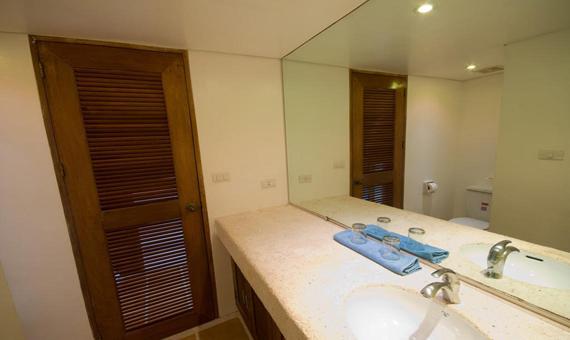
You are a GUI agent. You are given a task and a screenshot of the screen. Output one action in this format:
    pyautogui.click(x=<x>, y=<y>)
    Task: Click on the beige and white granite design countertop
    The width and height of the screenshot is (570, 340).
    Given the screenshot: What is the action you would take?
    pyautogui.click(x=286, y=257)